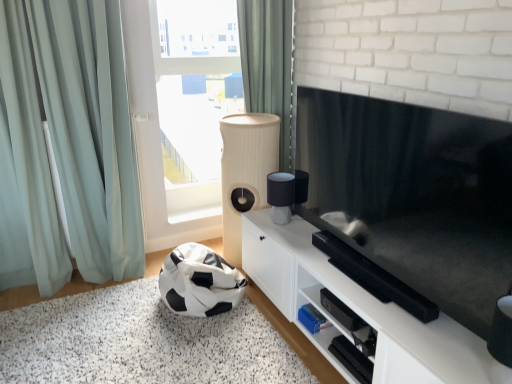
This screenshot has width=512, height=384. What are the coordinates of `free spot in front of black and white fabric bean bag at lower left` in the screenshot? It's located at (173, 349).